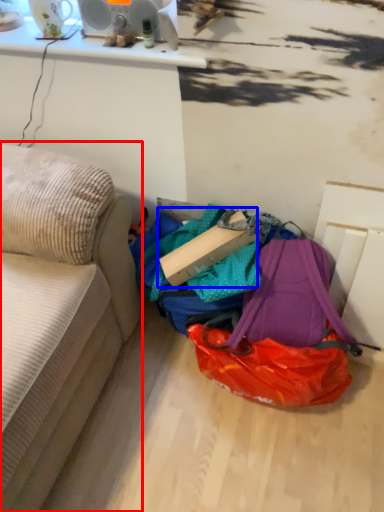
Question: Which point is closer to the camera, studio couch (highlighted by a red box) or cardboard box (highlighted by a blue box)?

Choices:
 (A) studio couch
 (B) cardboard box

Answer: (A)